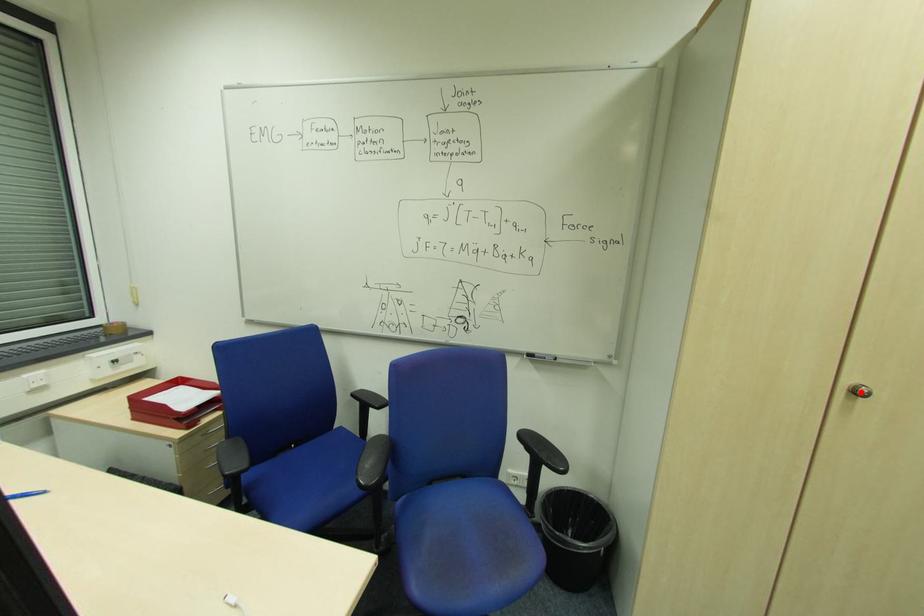
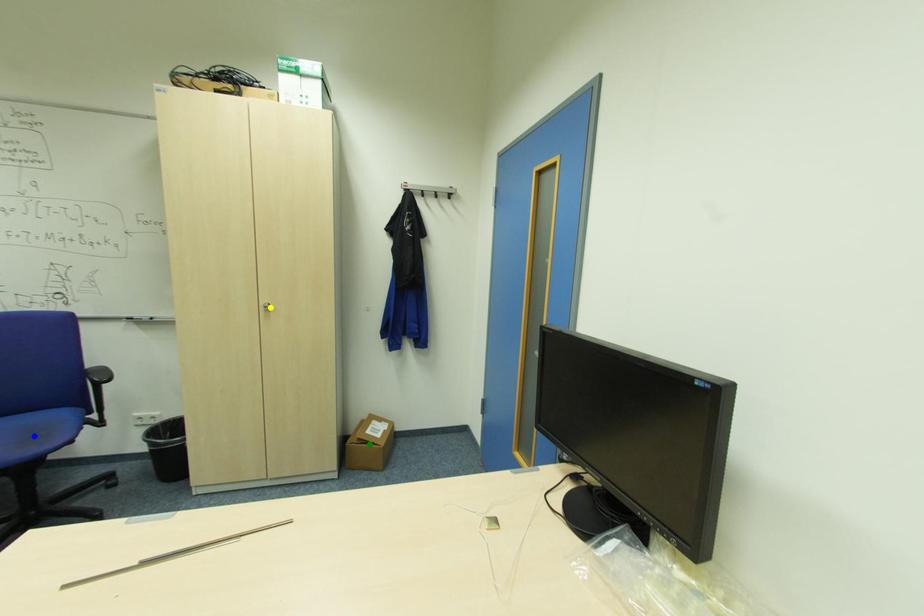
Question: I am providing you with two images of the same scene from different viewpoints. A red point is marked on the first image. You are given multiple points on the second image. In image 2, which mark is for the same physical point as the one in image 1?

Choices:
 (A) green point
 (B) yellow point
 (C) blue point

Answer: (B)